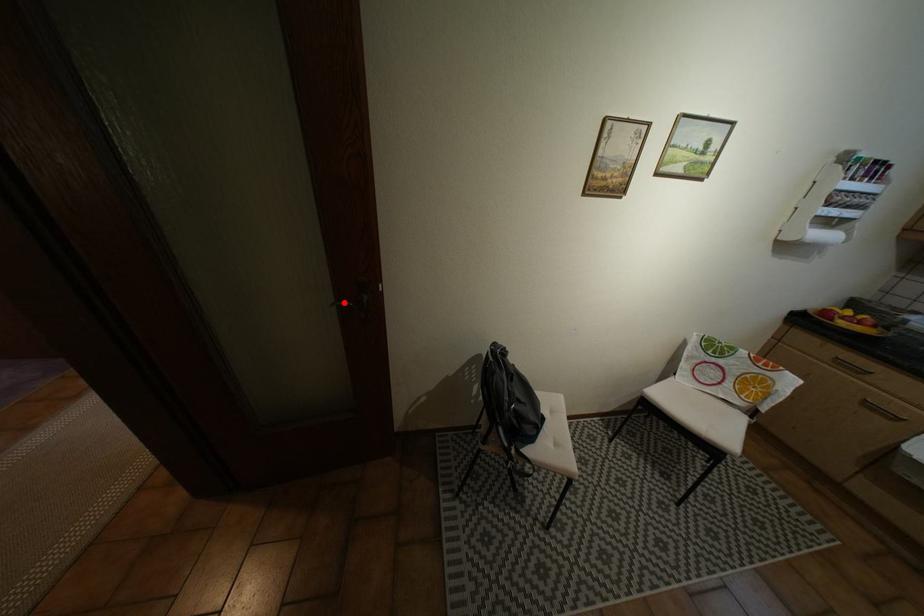
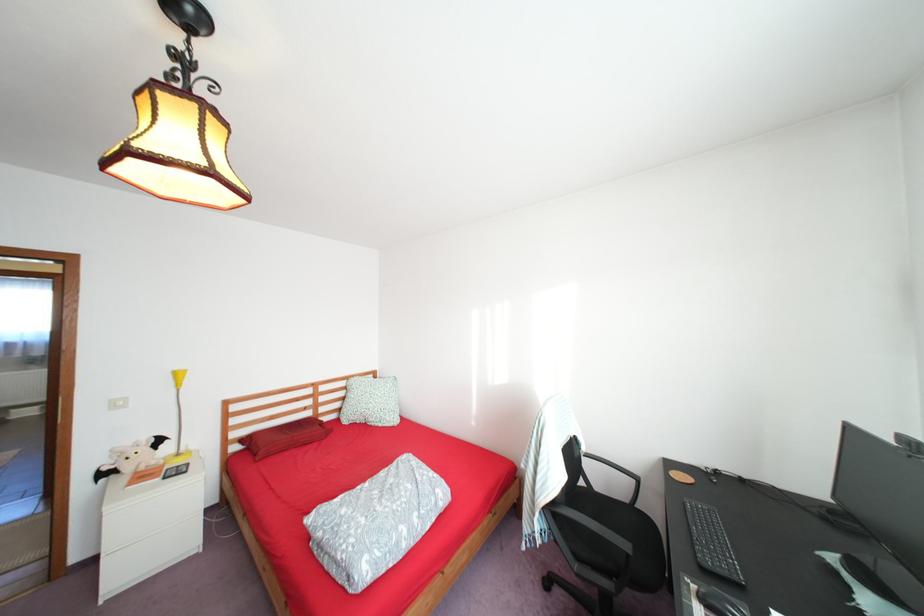
Question: I am providing you with two images of the same scene from different viewpoints. A red point is marked on the first image. Can you still see the location of the red point in image 2?

Choices:
 (A) Yes
 (B) No

Answer: (B)